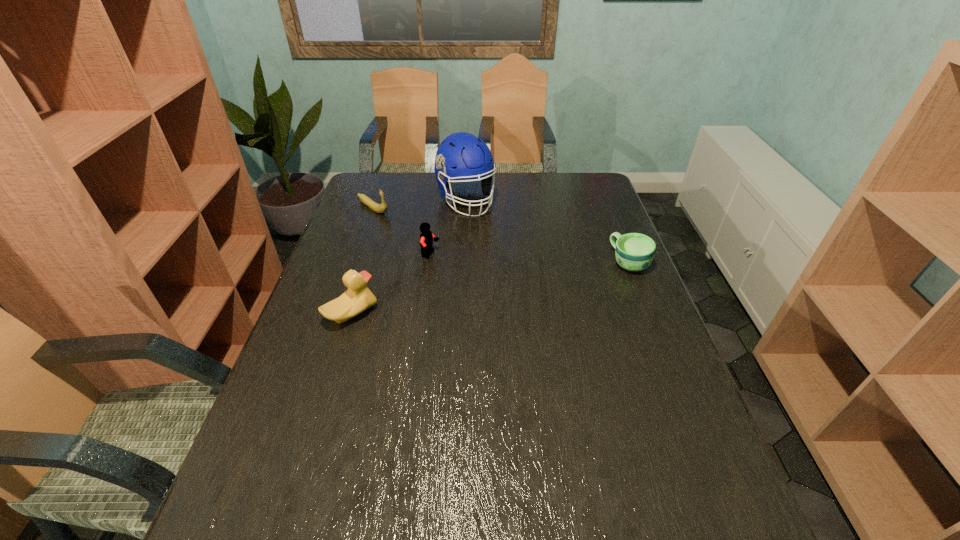
This screenshot has width=960, height=540. I want to click on banana that is at the left edge, so click(380, 208).

The image size is (960, 540). In order to click on object at the right edge in this screenshot , I will do `click(634, 252)`.

Identify the location of object located at the far left corner. The width and height of the screenshot is (960, 540). click(380, 208).

Image resolution: width=960 pixels, height=540 pixels. In the image, there is a desktop. In order to click on free space at the far edge in this screenshot , I will do `click(555, 173)`.

Where is `vacant space at the near edge of the desktop`? This screenshot has height=540, width=960. vacant space at the near edge of the desktop is located at coordinates (516, 461).

I want to click on vacant space at the left edge, so click(x=389, y=211).

You are a GUI agent. You are given a task and a screenshot of the screen. Output one action in this format:
    pyautogui.click(x=<x>, y=<y>)
    Task: Click on the vacant space at the right edge
    
    Given the screenshot: What is the action you would take?
    pyautogui.click(x=602, y=262)

Locate an element on the screen. Image resolution: width=960 pixels, height=540 pixels. vacant space at the far right corner is located at coordinates (598, 191).

Where is `free space that is in between the football helmet and the banana`? free space that is in between the football helmet and the banana is located at coordinates (420, 204).

Find the location of a particular element. unoccupied area between the shortest object and the nearest object is located at coordinates (491, 288).